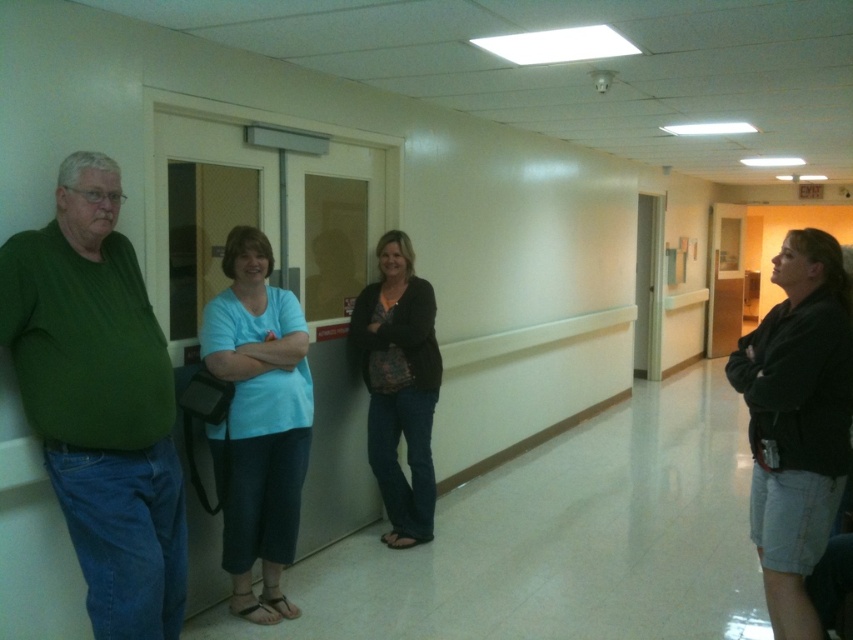
Question: Estimate the real-world distances between objects in this image. Which object is farther from the black denim shorts at lower right?

Choices:
 (A) light blue t-shirt at center
 (B) green matte sweater at left
 (C) black matte sweater at center

Answer: (B)

Question: Which object appears closest to the camera in this image?

Choices:
 (A) green matte sweater at left
 (B) light blue t-shirt at center
 (C) black denim shorts at lower right

Answer: (A)

Question: Is green matte sweater at left closer to the viewer compared to light blue t-shirt at center?

Choices:
 (A) yes
 (B) no

Answer: (A)

Question: Among these points, which one is nearest to the camera?

Choices:
 (A) (39, 340)
 (B) (770, 392)
 (C) (262, 572)
 (D) (401, 401)

Answer: (A)

Question: In this image, where is green matte sweater at left located relative to black matte sweater at center?

Choices:
 (A) right
 (B) left

Answer: (B)

Question: Can you confirm if black denim shorts at lower right is positioned above black matte sweater at center?

Choices:
 (A) no
 (B) yes

Answer: (A)